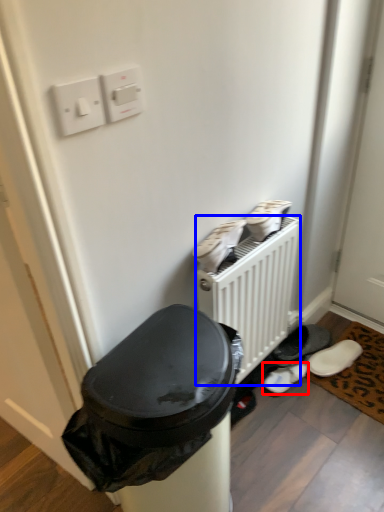
Question: Which object appears closest to the camera in this image, footwear (highlighted by a red box) or radiator (highlighted by a blue box)?

Choices:
 (A) footwear
 (B) radiator

Answer: (B)